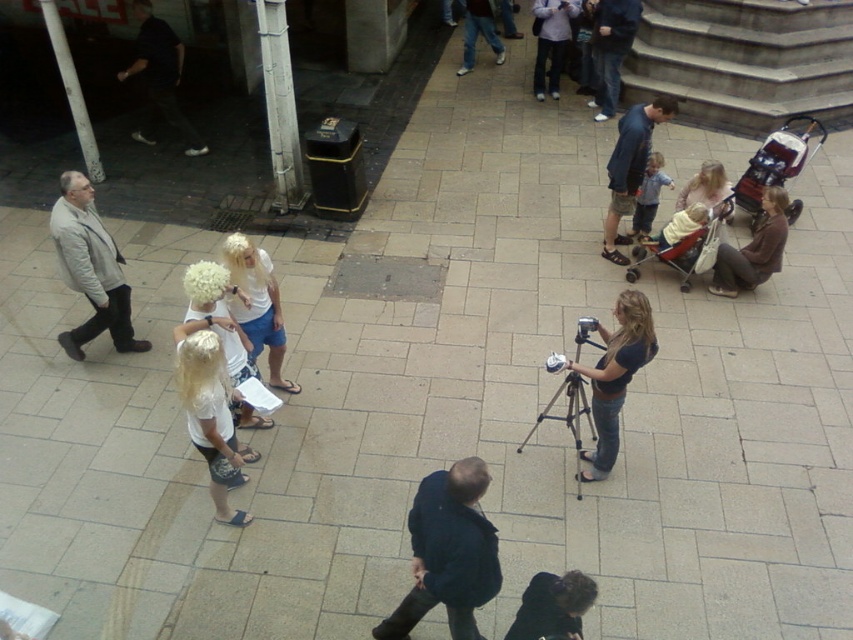
Does white matte shorts at lower left appear on the right side of light pink fabric jacket at upper center?

In fact, white matte shorts at lower left is to the left of light pink fabric jacket at upper center.

What do you see at coordinates (210, 412) in the screenshot? I see `white matte shorts at lower left` at bounding box center [210, 412].

Where is `white matte shorts at lower left`? The image size is (853, 640). white matte shorts at lower left is located at coordinates (210, 412).

Does dark blue jeans at center have a lesser height compared to blonde hair at center?

No.

The image size is (853, 640). What do you see at coordinates (611, 51) in the screenshot?
I see `dark blue jeans at center` at bounding box center [611, 51].

The image size is (853, 640). Find the location of `dark blue jeans at center`. dark blue jeans at center is located at coordinates (611, 51).

Between dark blue jeans at upper left and dark blue hoodie at center, which one is positioned lower?

dark blue hoodie at center is below.

Can you confirm if dark blue jeans at upper left is positioned above dark blue hoodie at center?

Indeed, dark blue jeans at upper left is positioned over dark blue hoodie at center.

Where is `dark blue jeans at upper left`? The width and height of the screenshot is (853, 640). dark blue jeans at upper left is located at coordinates (160, 77).